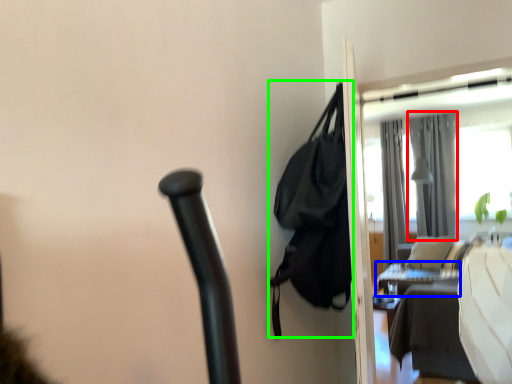
Question: Based on their relative distances, which object is farther from curtain (highlighted by a red box)? Choose from table (highlighted by a blue box) and bag (highlighted by a green box).

Choices:
 (A) table
 (B) bag

Answer: (B)